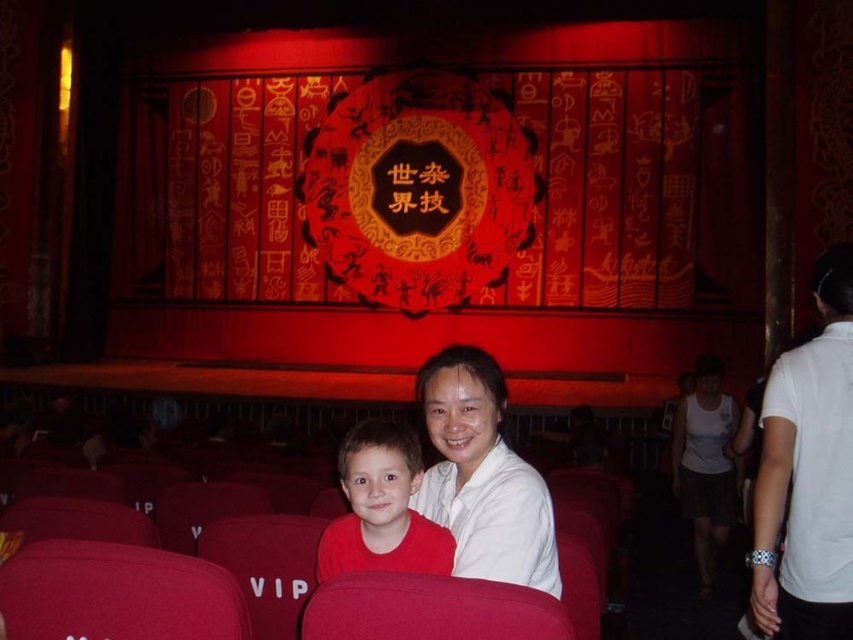
Does point (567, 632) come behind point (277, 577)?

That is False.

Is point (459, 611) closer to viewer compared to point (285, 582)?

Yes, point (459, 611) is closer to viewer.

At what (x,y) coordinates should I click in order to perform the action: click on suede-like red seat at center. Please return your answer as a coordinate pair (x, y). Image resolution: width=853 pixels, height=640 pixels. Looking at the image, I should click on (428, 609).

Can you confirm if velvet red seat at lower left is wider than white fabric skirt at lower right?

No, velvet red seat at lower left is not wider than white fabric skirt at lower right.

In the scene shown: Between velvet red seat at lower left and white fabric skirt at lower right, which one is positioned lower?

Positioned lower is white fabric skirt at lower right.

Does point (131, 637) come farther from viewer compared to point (701, 490)?

No, (131, 637) is in front of (701, 490).

Identify the location of velvet red seat at lower left. (117, 595).

Does velvet red seat at lower left have a lesser height compared to vip fabric at center?

Incorrect, velvet red seat at lower left's height does not fall short of vip fabric at center's.

Identify the location of velvet red seat at lower left. (117, 595).

At what (x,y) coordinates should I click in order to perform the action: click on velvet red seat at lower left. Please return your answer as a coordinate pair (x, y). Looking at the image, I should click on (117, 595).